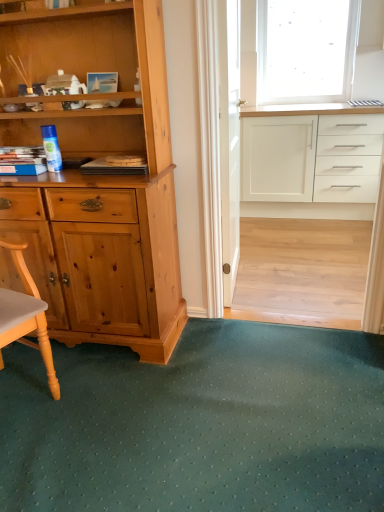
Where is `free location in front of clear glass screen door at center`? The image size is (384, 512). free location in front of clear glass screen door at center is located at coordinates (276, 298).